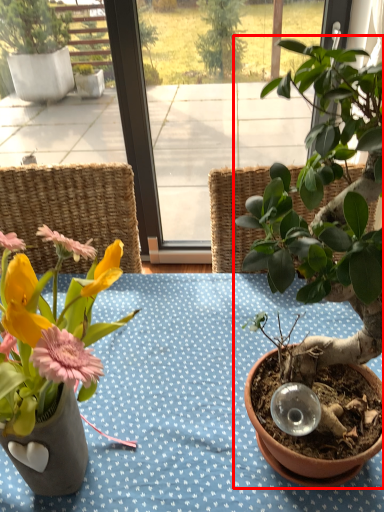
Question: Observing the image, what is the correct spatial positioning of houseplant (annotated by the red box) in reference to flower?

Choices:
 (A) right
 (B) left

Answer: (A)